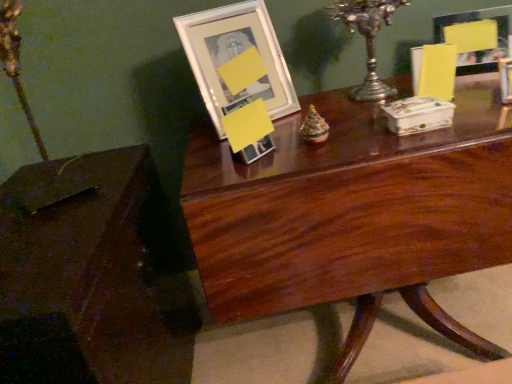
Question: Considering the positions of point (497, 21) and point (462, 153), is point (497, 21) closer or farther from the camera than point (462, 153)?

Choices:
 (A) closer
 (B) farther

Answer: (B)

Question: From the image's perspective, is matte glass picture frame at upper right, which is counted as the 2th picture frame, starting from the left, above or below mahogany wood table at center, acting as the first table starting from the right?

Choices:
 (A) above
 (B) below

Answer: (A)

Question: Estimate the real-world distances between objects in this image. Which object is farther from the matte glass picture frame at upper right, acting as the 1th picture frame starting from the right?

Choices:
 (A) mahogany wood table at center, acting as the first table starting from the right
 (B) silver metallic candle holder at upper center
 (C) white glossy picture frame at upper center, placed as the 2th picture frame when sorted from right to left
 (D) brown polished wood table at lower left, the 2th table viewed from the right

Answer: (D)

Question: Which object is positioned farthest from the matte glass picture frame at upper right, acting as the 1th picture frame starting from the right?

Choices:
 (A) mahogany wood table at center, acting as the first table starting from the right
 (B) brown polished wood table at lower left, the 2th table viewed from the right
 (C) white glossy picture frame at upper center, placed as the 2th picture frame when sorted from right to left
 (D) silver metallic candle holder at upper center

Answer: (B)